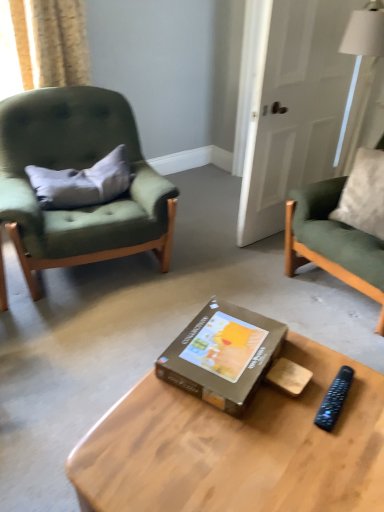
This screenshot has height=512, width=384. In order to click on blank space situated above wooden coffee table at center (from a real-world perspective) in this screenshot , I will do `click(266, 434)`.